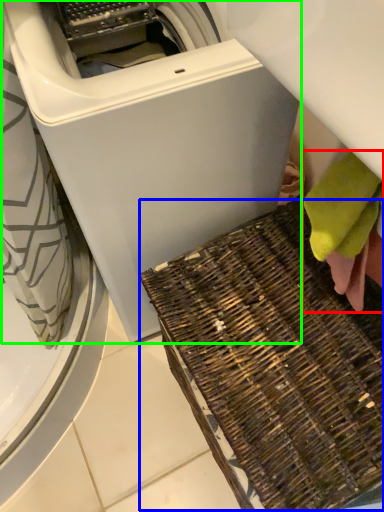
Question: Which object is the closest to the bath towel (highlighted by a red box)? Choose among these: waste (highlighted by a blue box) or washing machine (highlighted by a green box).

Choices:
 (A) waste
 (B) washing machine

Answer: (A)